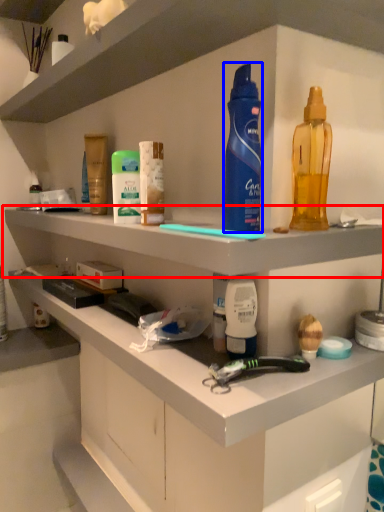
Question: Which object is further to the camera taking this photo, shelf (highlighted by a red box) or cleaning product (highlighted by a blue box)?

Choices:
 (A) shelf
 (B) cleaning product

Answer: (B)